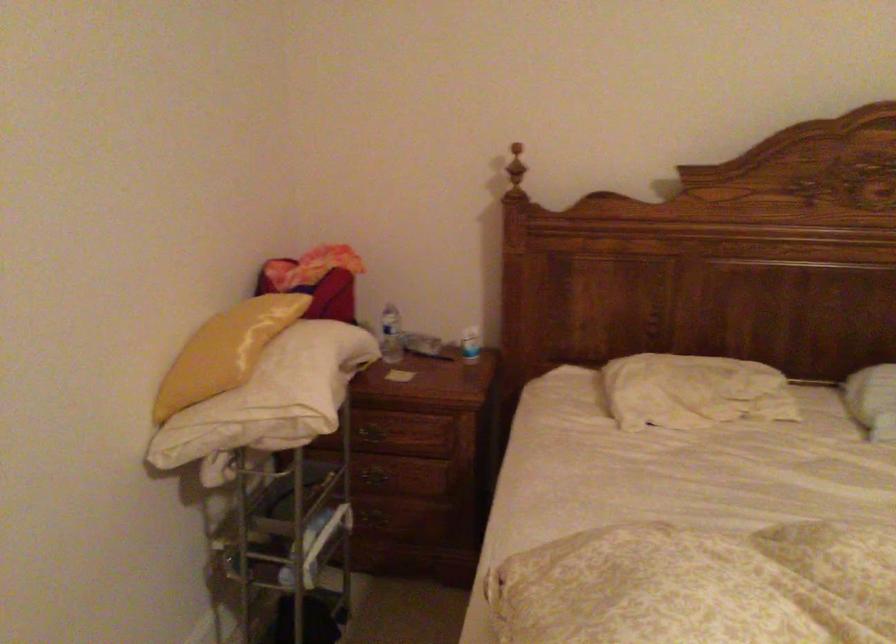
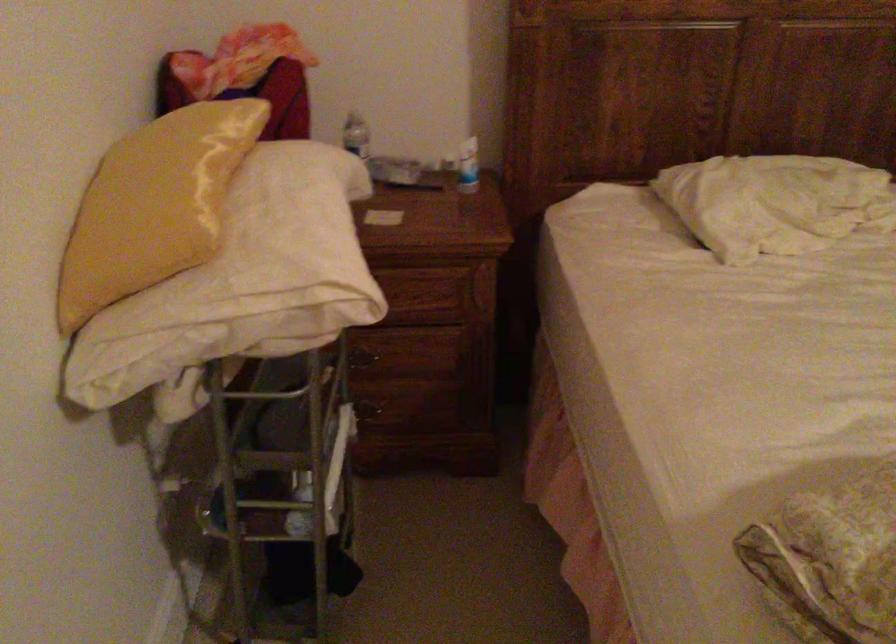
Question: I am providing you with two images of the same scene from different viewpoints. Please identify which objects are invisible in image2.

Choices:
 (A) white spray can
 (B) yellow pillow
 (C) plastic water bottle
 (D) plastic drink bottle

Answer: (C)